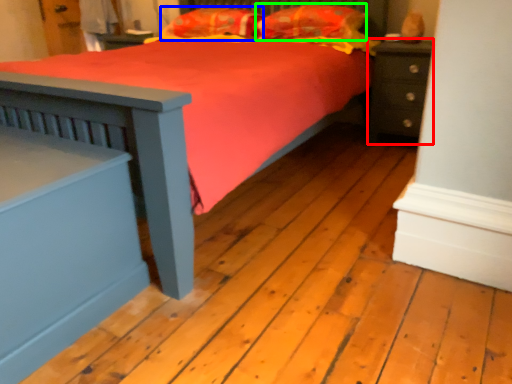
Question: Which object is positioned farthest from nightstand (highlighted by a red box)? Select from pillow (highlighted by a blue box) and pillow (highlighted by a green box).

Choices:
 (A) pillow
 (B) pillow

Answer: (A)